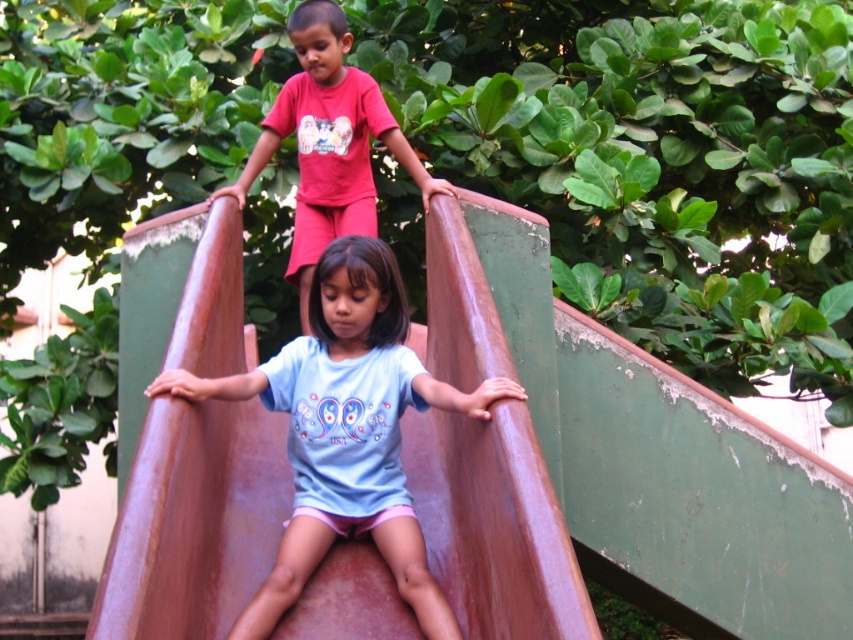
Question: Which point is closer to the camera?

Choices:
 (A) (387, 116)
 (B) (277, 403)

Answer: (B)

Question: Is light blue fabric shirt at center thinner than matte red pants at upper center?

Choices:
 (A) no
 (B) yes

Answer: (A)

Question: Which point is closer to the camera?

Choices:
 (A) (476, 406)
 (B) (311, 96)

Answer: (A)

Question: Is the position of light blue fabric shirt at center less distant than that of matte red pants at upper center?

Choices:
 (A) no
 (B) yes

Answer: (B)

Question: Can you confirm if light blue fabric shirt at center is smaller than matte red pants at upper center?

Choices:
 (A) no
 (B) yes

Answer: (B)